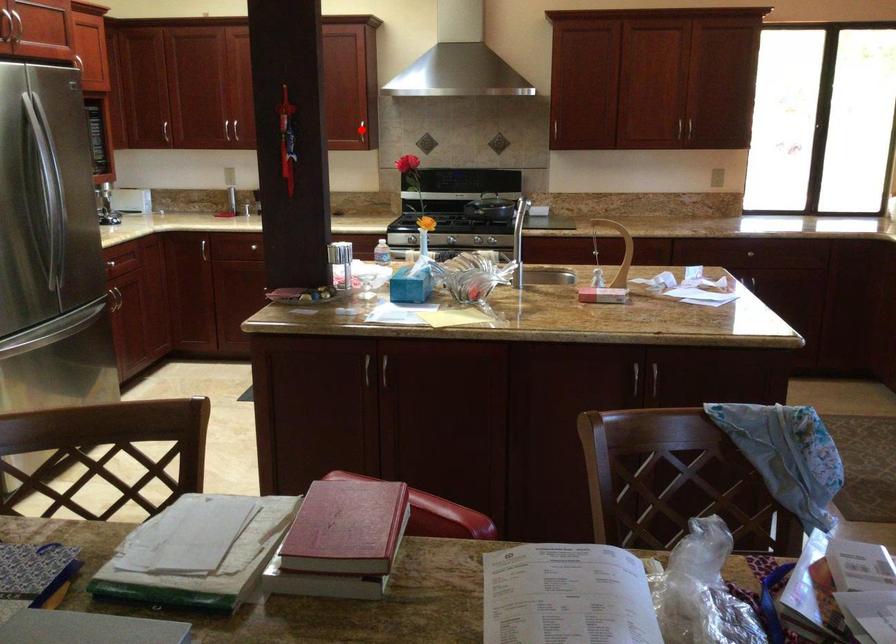
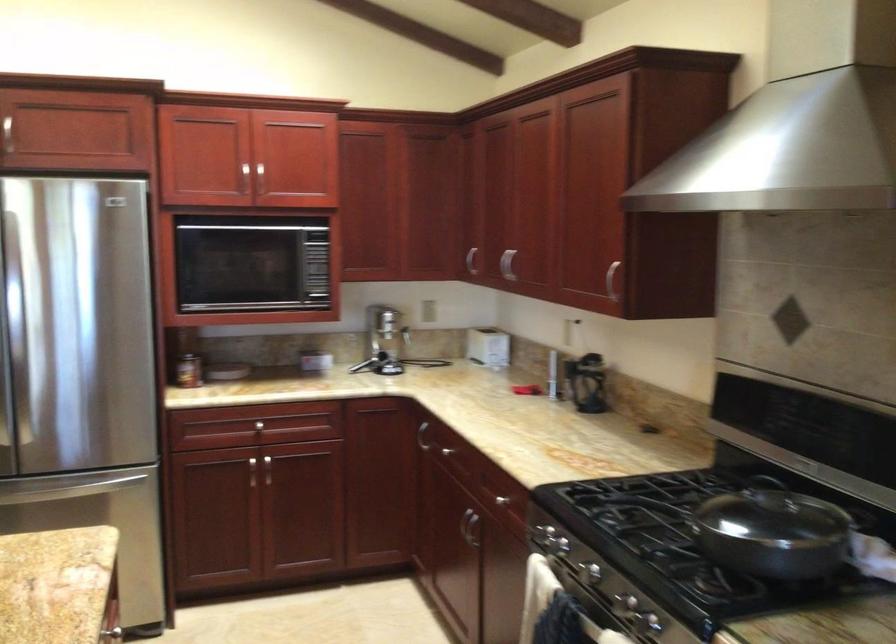
Question: I am providing you with two images of the same scene from different viewpoints. A red point is marked on the first image. Can you still see the location of the red point in image 2?

Choices:
 (A) Yes
 (B) No

Answer: (B)